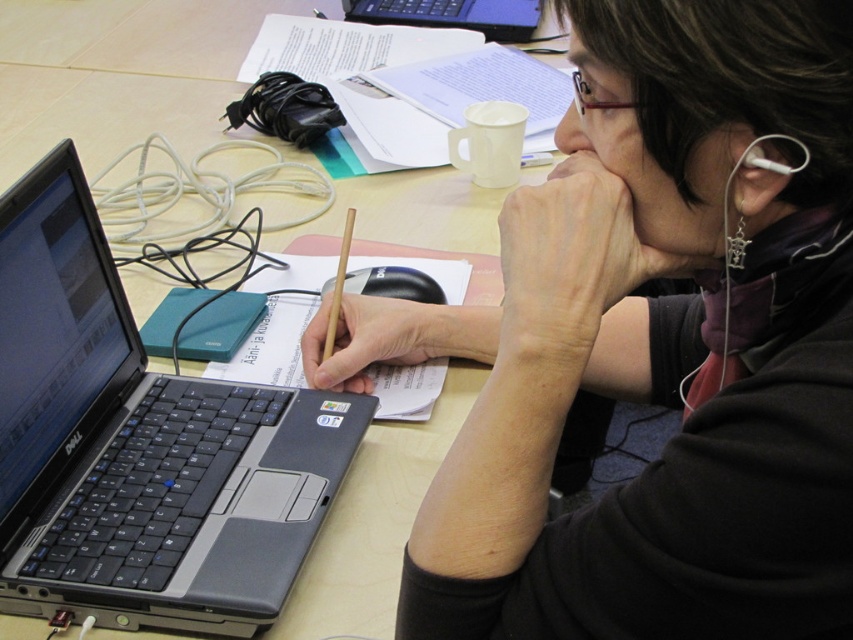
This screenshot has height=640, width=853. What do you see at coordinates (140, 445) in the screenshot? I see `silver metallic laptop at left` at bounding box center [140, 445].

Does silver metallic laptop at left have a lesser width compared to wooden table at center?

Correct, silver metallic laptop at left's width is less than wooden table at center's.

Who is more distant from viewer, (126, 417) or (479, 209)?

Point (479, 209)

You are a GUI agent. You are given a task and a screenshot of the screen. Output one action in this format:
    pyautogui.click(x=<x>, y=<y>)
    Task: Click on the silver metallic laptop at left
    Image resolution: width=853 pixels, height=640 pixels.
    Given the screenshot: What is the action you would take?
    pyautogui.click(x=140, y=445)

Which is below, dry skin at center or silver metallic laptop at upper center?

Positioned lower is dry skin at center.

Can you confirm if dry skin at center is wider than silver metallic laptop at upper center?

No.

Describe the element at coordinates (564, 262) in the screenshot. I see `dry skin at center` at that location.

Identify the location of dry skin at center. (564, 262).

Does dry skin at center have a lesser height compared to matte skin nose at center?

Incorrect, dry skin at center's height does not fall short of matte skin nose at center's.

Can you confirm if dry skin at center is positioned to the right of matte skin nose at center?

Incorrect, dry skin at center is not on the right side of matte skin nose at center.

The image size is (853, 640). Identify the location of dry skin at center. (564, 262).

Find the location of a particular element. The height and width of the screenshot is (640, 853). dry skin at center is located at coordinates (564, 262).